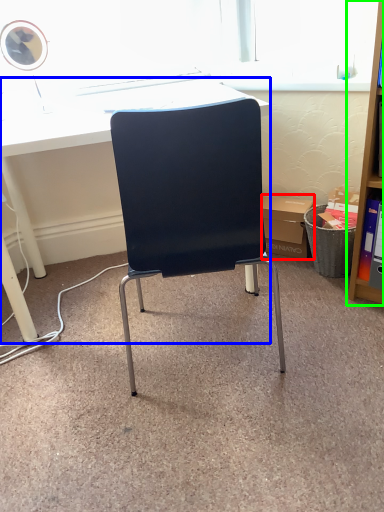
Question: Estimate the real-world distances between objects in this image. Which object is farther from box (highlighted by a red box), desk (highlighted by a blue box) or shelf (highlighted by a green box)?

Choices:
 (A) desk
 (B) shelf

Answer: (A)